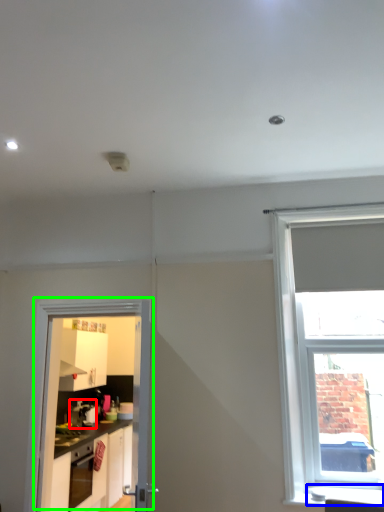
Question: Based on their relative distances, which object is farther from coffee machine (highlighted by a red box)? Choose from window sill (highlighted by a blue box) and door (highlighted by a green box).

Choices:
 (A) window sill
 (B) door

Answer: (A)